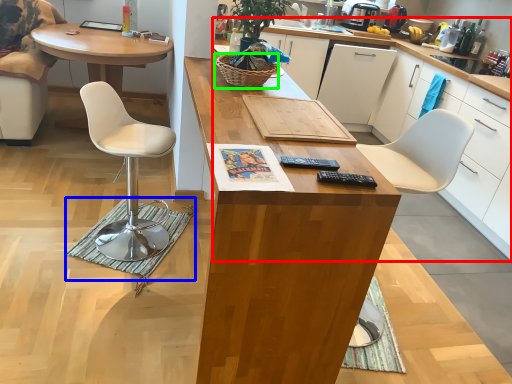
Question: Which object is positioned farthest from cabinetry (highlighted by a red box)? Select from mat (highlighted by a blue box) and picnic basket (highlighted by a green box).

Choices:
 (A) mat
 (B) picnic basket

Answer: (A)